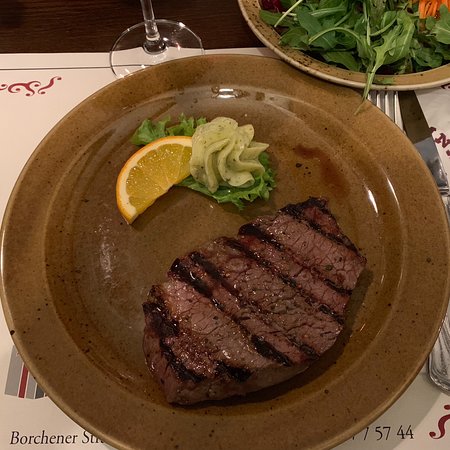
This screenshot has width=450, height=450. What are the coordinates of `cutlery` in the screenshot? It's located at (421, 129).